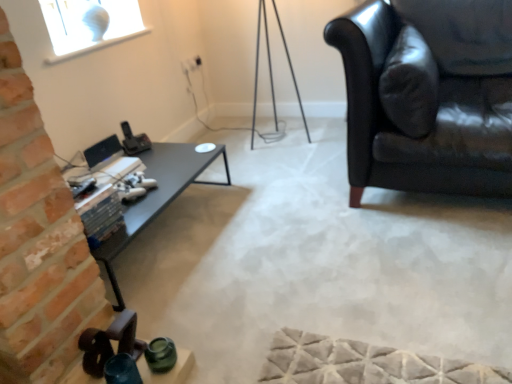
Question: From the image's perspective, is black leather couch at right above black glossy table at left?

Choices:
 (A) no
 (B) yes

Answer: (B)

Question: From a real-world perspective, is black leather couch at right positioned under black glossy table at left based on gravity?

Choices:
 (A) no
 (B) yes

Answer: (A)

Question: Can you confirm if black leather couch at right is thinner than black glossy table at left?

Choices:
 (A) no
 (B) yes

Answer: (A)

Question: From a real-world perspective, is black leather couch at right on black glossy table at left?

Choices:
 (A) yes
 (B) no

Answer: (A)

Question: Does black leather couch at right appear on the left side of black glossy table at left?

Choices:
 (A) no
 (B) yes

Answer: (A)

Question: Does black leather couch at right turn towards black glossy table at left?

Choices:
 (A) no
 (B) yes

Answer: (A)

Question: From the image's perspective, does satin black monitor at center appear lower than black leather couch at right?

Choices:
 (A) no
 (B) yes

Answer: (B)

Question: Considering the relative sizes of satin black monitor at center and black leather couch at right in the image provided, is satin black monitor at center bigger than black leather couch at right?

Choices:
 (A) yes
 (B) no

Answer: (B)

Question: Does satin black monitor at center have a lesser height compared to black leather couch at right?

Choices:
 (A) no
 (B) yes

Answer: (B)

Question: Are satin black monitor at center and black leather couch at right beside each other?

Choices:
 (A) no
 (B) yes

Answer: (A)

Question: Is black leather couch at right at the back of satin black monitor at center?

Choices:
 (A) yes
 (B) no

Answer: (B)

Question: From a real-world perspective, is satin black monitor at center positioned over black leather couch at right based on gravity?

Choices:
 (A) no
 (B) yes

Answer: (A)

Question: Can you confirm if black glossy table at left is smaller than black leather couch at right?

Choices:
 (A) yes
 (B) no

Answer: (A)